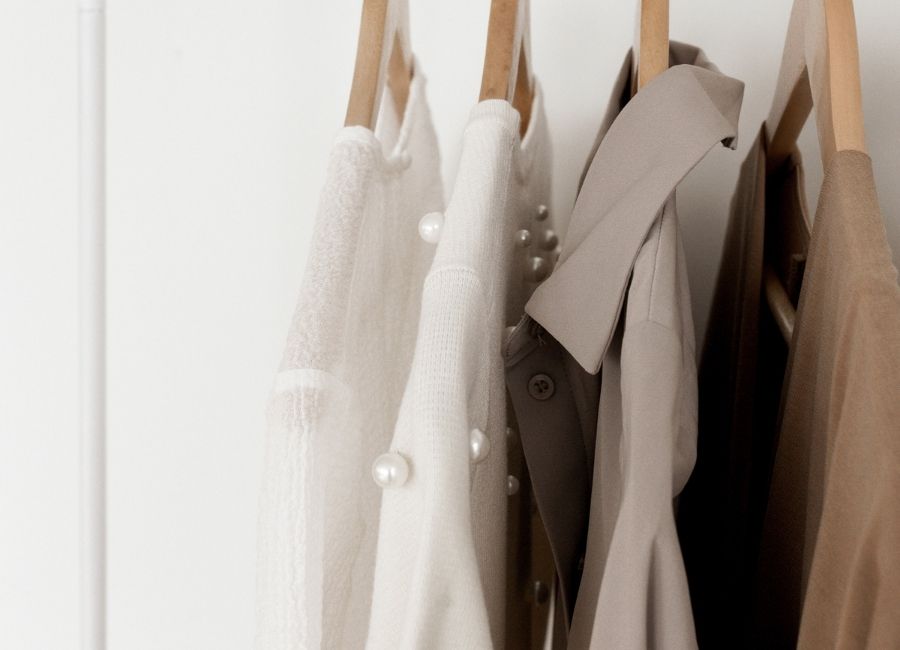
Find the location of `clothes hangers`. clothes hangers is located at coordinates (387, 54), (508, 58), (643, 40), (829, 78).